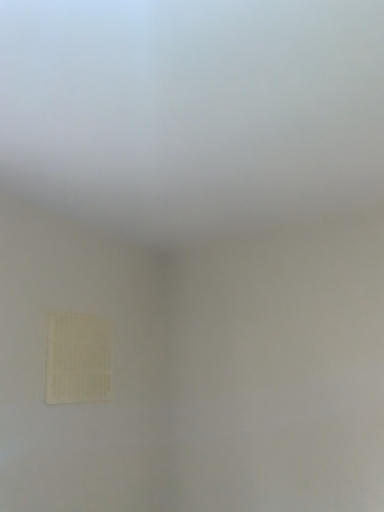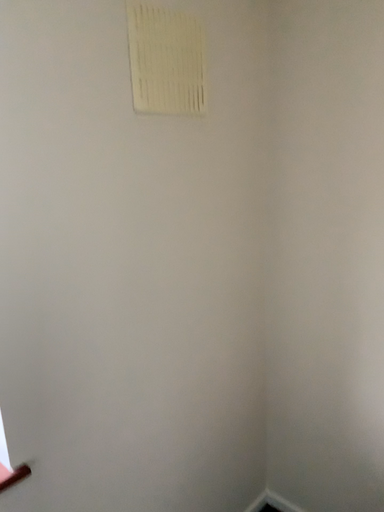
Question: How did the camera likely rotate when shooting the video?

Choices:
 (A) rotated downward
 (B) rotated upward

Answer: (A)